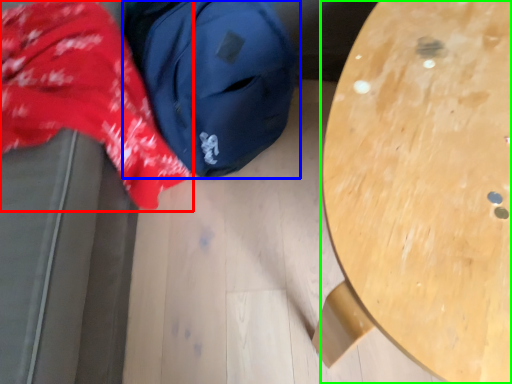
Question: Based on their relative distances, which object is farther from clothing (highlighted by a red box)? Choose from backpack (highlighted by a blue box) and table (highlighted by a green box).

Choices:
 (A) backpack
 (B) table

Answer: (B)